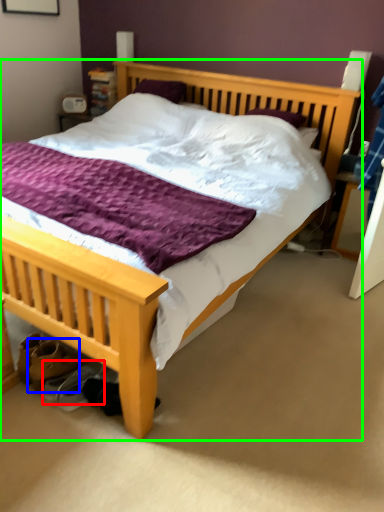
Question: Estimate the real-world distances between objects in this image. Which object is farther from shoe (highlighted by a red box), footwear (highlighted by a blue box) or bed (highlighted by a green box)?

Choices:
 (A) footwear
 (B) bed

Answer: (B)